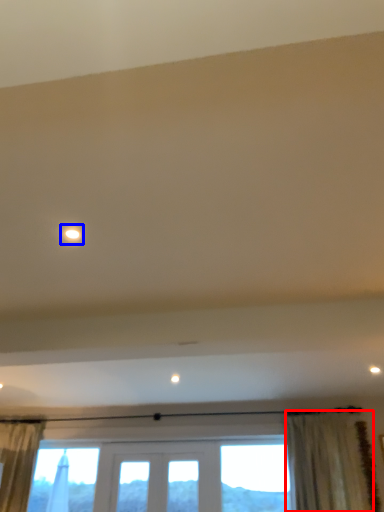
Question: Which object appears farthest to the camera in this image, curtain (highlighted by a red box) or light (highlighted by a blue box)?

Choices:
 (A) curtain
 (B) light

Answer: (A)